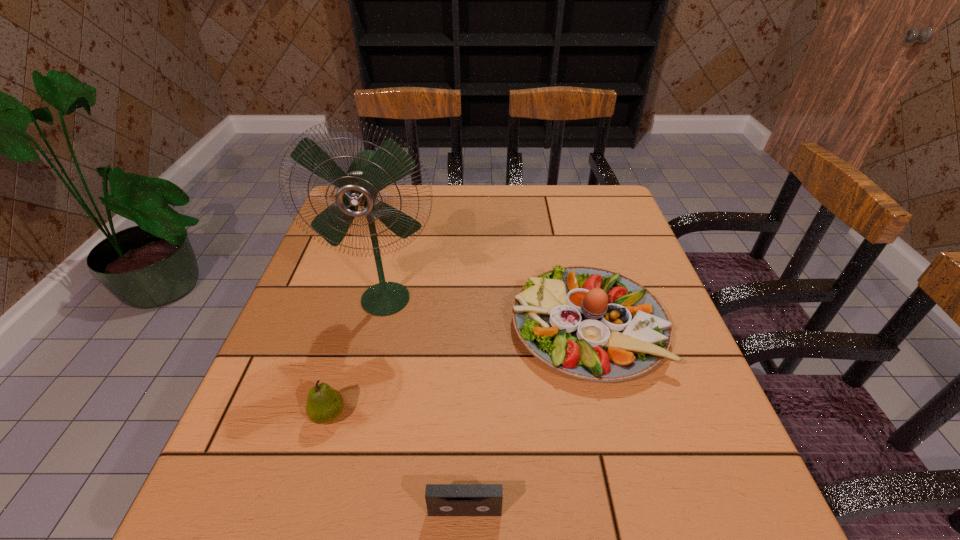
I want to click on vacant area that lies between the third shortest object and the nearest object, so click(526, 418).

Point out which object is positioned as the third nearest to the third shortest object. Please provide its 2D coordinates. Your answer should be formatted as a tuple, i.e. [(x, y)], where the tuple contains the x and y coordinates of a point satisfying the conditions above.

[(324, 405)]

At what (x,y) coordinates should I click in order to perform the action: click on object that is the third closest to the shortest object. Please return your answer as a coordinate pair (x, y). This screenshot has width=960, height=540. Looking at the image, I should click on (370, 172).